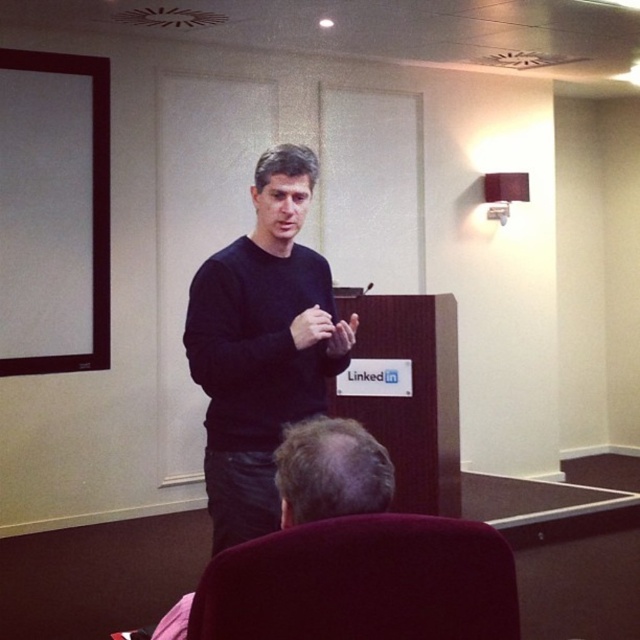
Who is more forward, [278,396] or [312,531]?

Positioned in front is point [312,531].

Looking at this image, is black matte sweater at center smaller than velvet maroon chair at lower center?

No.

Which is in front, point (214, 321) or point (320, 605)?

Positioned in front is point (320, 605).

What are the coordinates of `black matte sweater at center` in the screenshot? It's located at (260, 346).